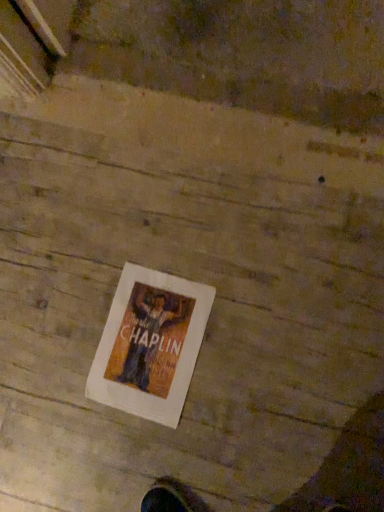
Locate an element on the screen. vacant space in white paper poster at center (from a real-world perspective) is located at coordinates (148, 345).